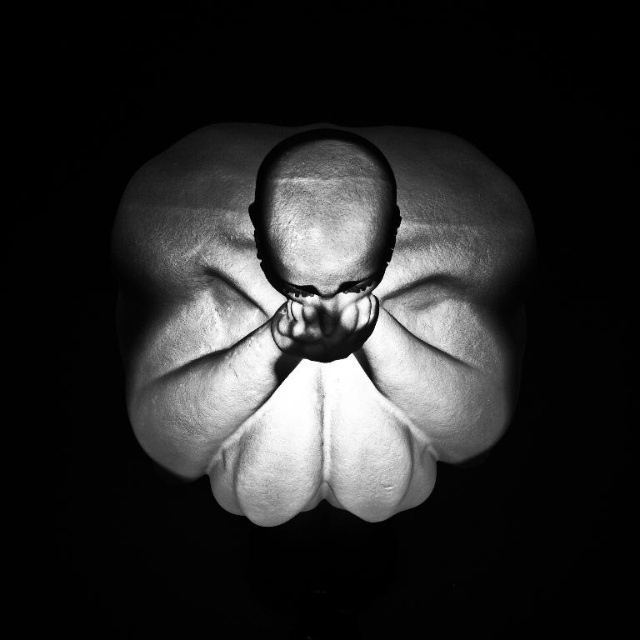
Measure the distance from smooth flesh flower at center to smooth skin hand at center.

smooth flesh flower at center is 13.15 inches away from smooth skin hand at center.

Between smooth flesh flower at center and smooth skin hand at center, which one has less height?

smooth skin hand at center is shorter.

What do you see at coordinates (323, 298) in the screenshot? I see `smooth flesh flower at center` at bounding box center [323, 298].

At what (x,y) coordinates should I click in order to perform the action: click on smooth flesh flower at center. Please return your answer as a coordinate pair (x, y). Looking at the image, I should click on (323, 298).